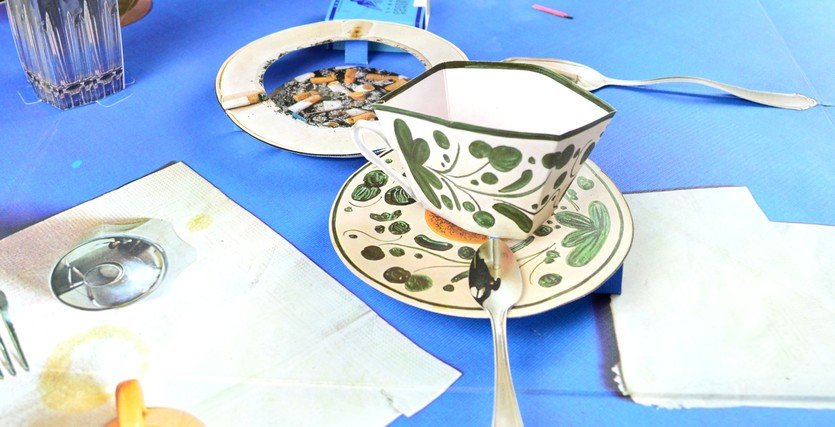
You are a GUI agent. You are given a task and a screenshot of the screen. Output one action in this format:
    pyautogui.click(x=<x>, y=<y>)
    Task: Click on the white placemat
    The height and width of the screenshot is (427, 835).
    Given the screenshot: What is the action you would take?
    pyautogui.click(x=261, y=318), pyautogui.click(x=812, y=245)